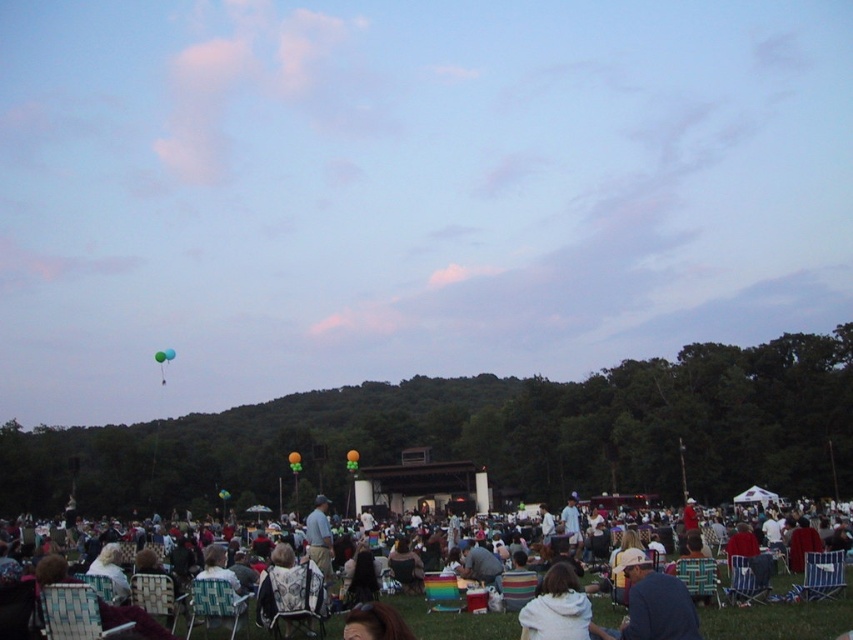
Question: From the image, what is the correct spatial relationship of gray fabric shirt at center in relation to blue glossy balloon at upper center?

Choices:
 (A) left
 (B) right

Answer: (B)

Question: Which of these objects is positioned farthest from the blue fabric jacket at lower right?

Choices:
 (A) green rubber balloon at upper center
 (B) white striped shirt at center
 (C) gray fabric shirt at center
 (D) blue glossy balloon at upper center

Answer: (A)

Question: Which point is farther to the camera?

Choices:
 (A) (329, 552)
 (B) (170, 352)
 (C) (165, 360)

Answer: (B)

Question: Which of the following is the closest to the observer?

Choices:
 (A) blue glossy balloon at upper center
 (B) green rubber balloon at upper center
 (C) gray fabric shirt at center
 (D) white striped shirt at center

Answer: (D)

Question: Does blue glossy balloon at upper center appear over green rubber balloon at upper center?

Choices:
 (A) no
 (B) yes

Answer: (B)

Question: Where is white striped shirt at center located in relation to green rubber balloon at upper center in the image?

Choices:
 (A) left
 (B) right

Answer: (B)